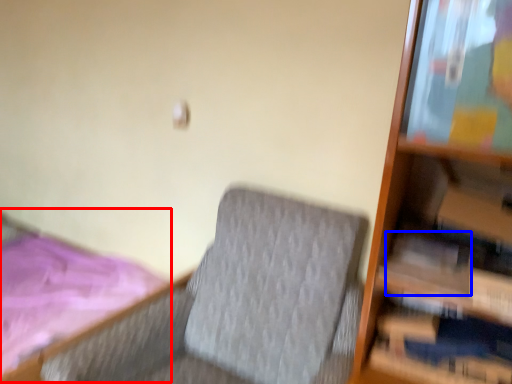
Question: Which object is closer to the camera taking this photo, bed (highlighted by a red box) or paperback book (highlighted by a blue box)?

Choices:
 (A) bed
 (B) paperback book

Answer: (B)